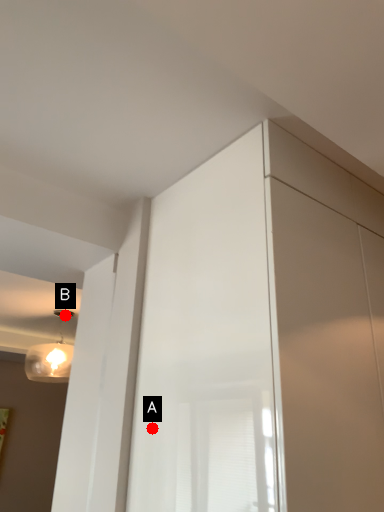
Question: Two points are circled on the image, labeled by A and B beside each circle. Which point appears farthest from the camera in this image?

Choices:
 (A) A is further
 (B) B is further

Answer: (B)